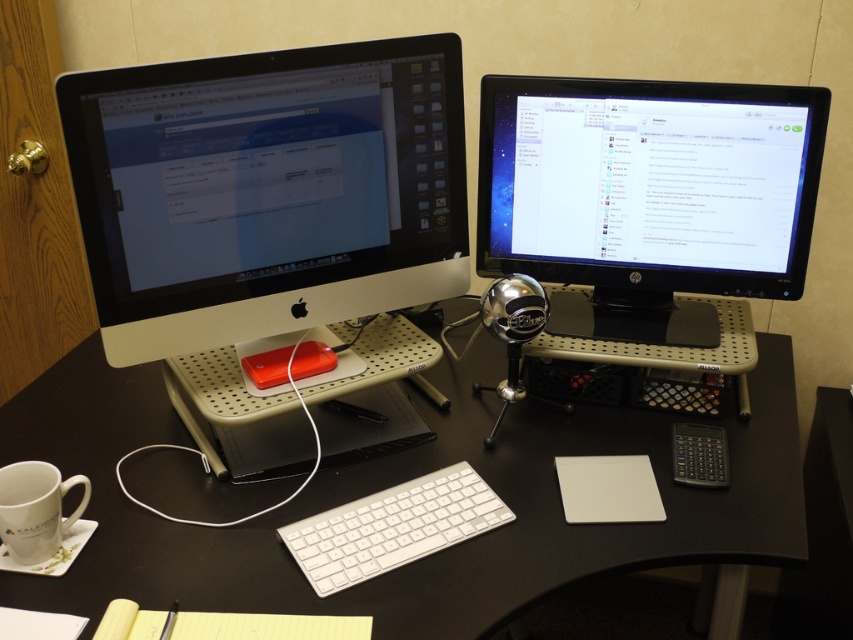
Question: Where is white plastic keyboard at center located in relation to white ceramic mug at lower left in the image?

Choices:
 (A) right
 (B) left

Answer: (A)

Question: Is the position of white plastic keyboard at center less distant than that of white ceramic mug at lower left?

Choices:
 (A) yes
 (B) no

Answer: (B)

Question: Among these points, which one is farthest from the camera?

Choices:
 (A) (80, 211)
 (B) (370, 499)
 (C) (802, 557)
 (D) (55, 531)

Answer: (B)

Question: Which of the following is the closest to the observer?

Choices:
 (A) white plastic keyboard at center
 (B) white glossy desktop computer at left

Answer: (A)

Question: Can you confirm if black glossy monitor at upper right is thinner than white plastic keyboard at center?

Choices:
 (A) no
 (B) yes

Answer: (A)

Question: Which point appears farthest from the camera in this image?

Choices:
 (A) (786, 380)
 (B) (241, 163)

Answer: (A)